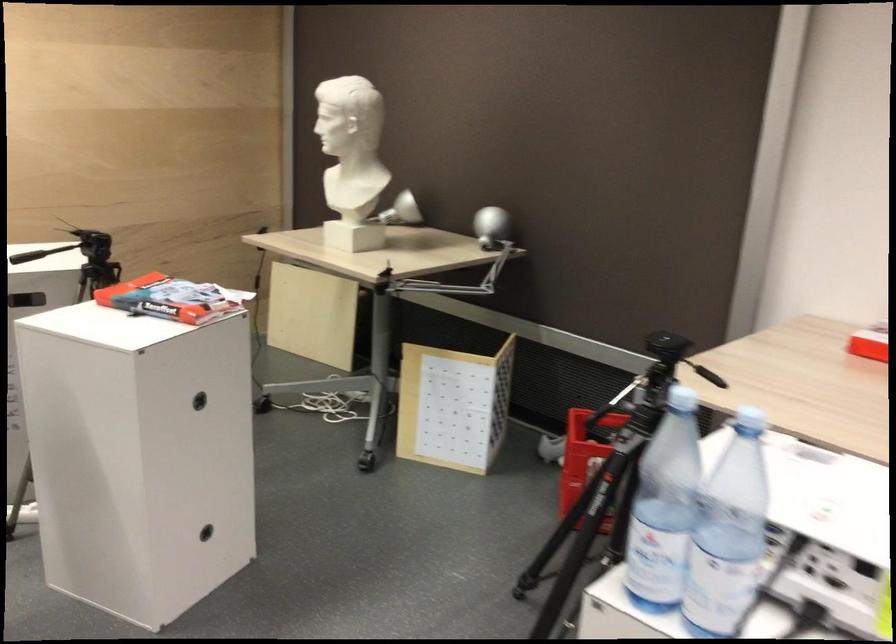
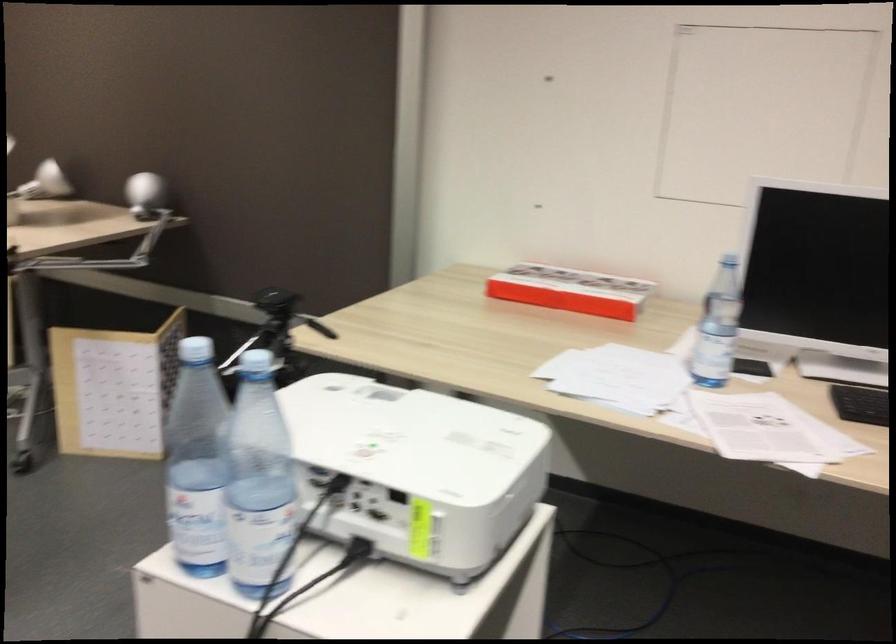
Question: Based on the continuous images, in which direction is the camera rotating? Reply with the corresponding letter.

Choices:
 (A) Left
 (B) Right
 (C) Up
 (D) Down

Answer: (B)